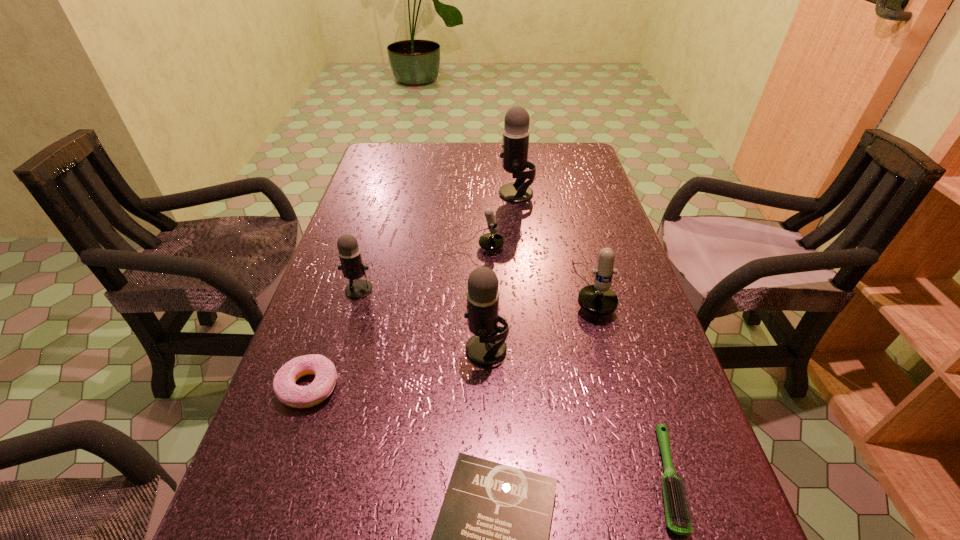
Identify which gray microphone is the closest to the book. Please provide its 2D coordinates. Your answer should be formatted as a tuple, i.e. [(x, y)], where the tuple contains the x and y coordinates of a point satisfying the conditions above.

[(486, 347)]

Where is `gray microphone that stands as the second closest to the doughnut`? This screenshot has width=960, height=540. gray microphone that stands as the second closest to the doughnut is located at coordinates (486, 347).

The width and height of the screenshot is (960, 540). I want to click on free point that satisfies the following two spatial constraints: 1. on the back side of the doughnut; 2. on the right side of the bigger white microphone, so click(x=342, y=289).